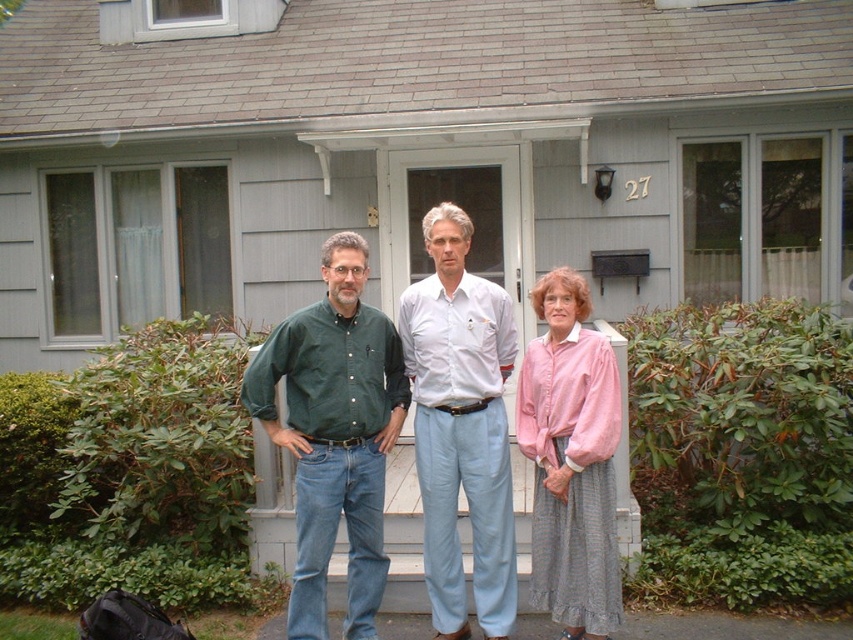
Does light blue cotton pants at center appear under pink linen blouse at center?

No.

Is light blue cotton pants at center above pink linen blouse at center?

Yes, light blue cotton pants at center is above pink linen blouse at center.

The image size is (853, 640). What are the coordinates of `light blue cotton pants at center` in the screenshot? It's located at click(x=461, y=426).

Who is higher up, green cotton shirt at center or light blue cotton pants at center?

green cotton shirt at center is higher up.

Is green cotton shirt at center below light blue cotton pants at center?

No.

Which is in front, point (502, 323) or point (468, 333)?

Point (468, 333) is in front.

Image resolution: width=853 pixels, height=640 pixels. What are the coordinates of `green cotton shirt at center` in the screenshot? It's located at (461, 426).

Is green denim shirt at center taller than light blue cotton pants at center?

In fact, green denim shirt at center may be shorter than light blue cotton pants at center.

This screenshot has width=853, height=640. Identify the location of green denim shirt at center. (334, 433).

Find the location of a particular element. This screenshot has height=640, width=853. green denim shirt at center is located at coordinates (334, 433).